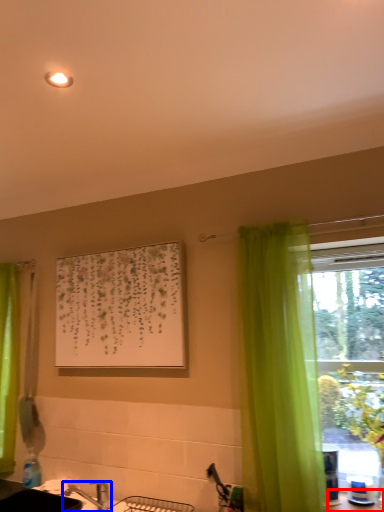
Question: Which of the following is the farthest to the observer, counter top (highlighted by a red box) or tap (highlighted by a blue box)?

Choices:
 (A) counter top
 (B) tap

Answer: (B)